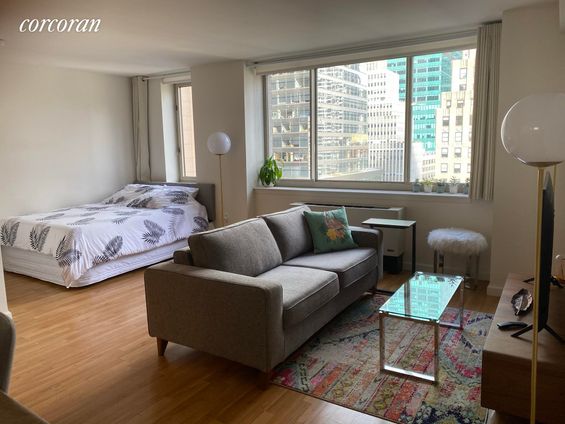
Identify the location of wall. This screenshot has width=565, height=424. (45, 153), (512, 223).